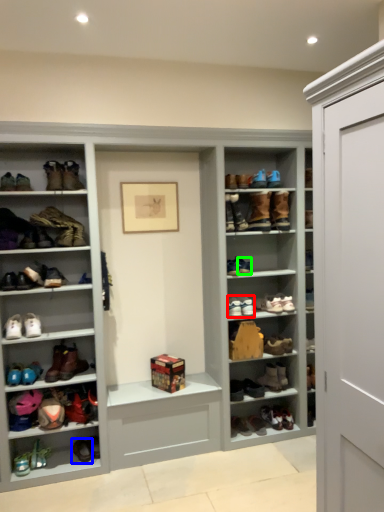
Question: Which is nearer to the shoe (highlighted by a red box)? footwear (highlighted by a blue box) or shoe (highlighted by a green box).

Choices:
 (A) footwear
 (B) shoe

Answer: (B)